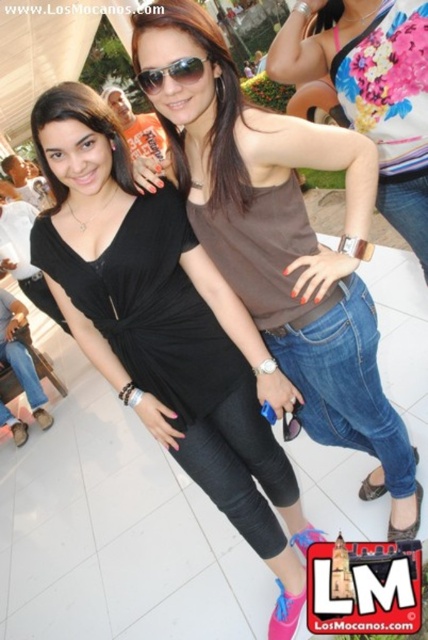
Question: Can you confirm if brown matte tank top at center is positioned to the right of sunglasses at center?

Choices:
 (A) no
 (B) yes

Answer: (B)

Question: Can you confirm if brown matte tank top at center is wider than sunglasses at center?

Choices:
 (A) no
 (B) yes

Answer: (B)

Question: Which point is farther to the camera?

Choices:
 (A) tap(142, 83)
 (B) tap(374, 148)
 (C) tap(309, 10)

Answer: (C)

Question: Which object is the closest to the brown fabric tank top at center?

Choices:
 (A) sunglasses at center
 (B) brown matte tank top at center
 (C) black matte tank top at center

Answer: (B)

Question: Does black matte tank top at center have a lesser width compared to sunglasses at center?

Choices:
 (A) yes
 (B) no

Answer: (B)

Question: Which of the following is the farthest from the observer?

Choices:
 (A) (303, 209)
 (B) (74, 225)
 (C) (180, 58)
 (D) (342, 70)

Answer: (D)